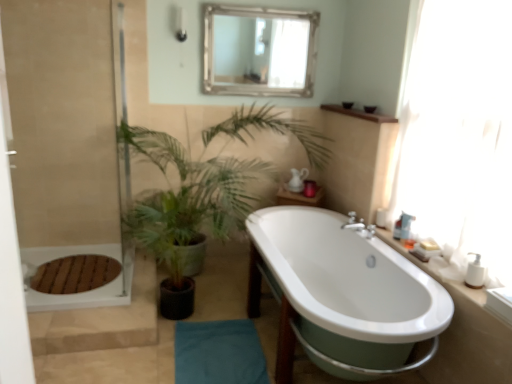
What are the coordinates of `empty space that is ontop of blue fabric bath mat at lower center (from a real-world perspective)` in the screenshot? It's located at (215, 356).